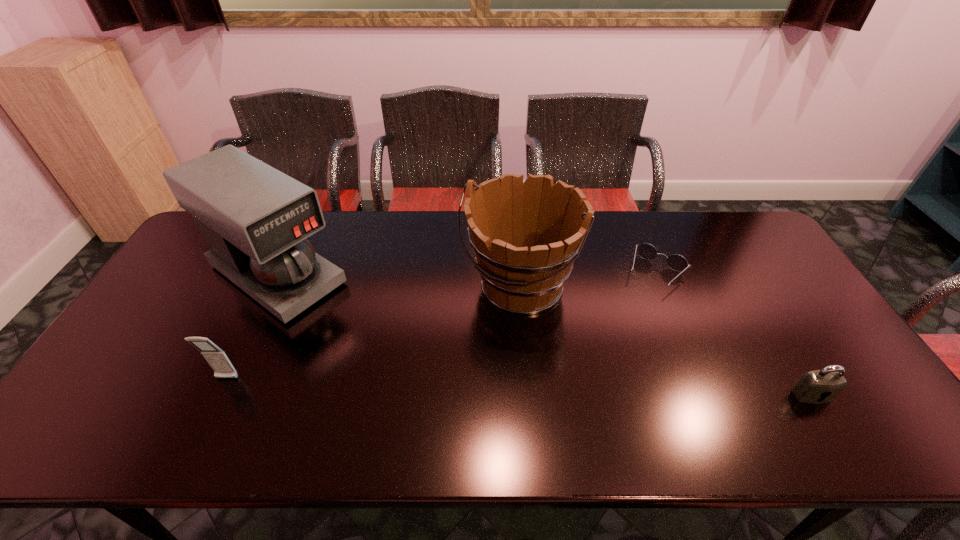
This screenshot has width=960, height=540. What are the coordinates of `the third tallest object` in the screenshot? It's located at (217, 359).

This screenshot has width=960, height=540. I want to click on cellular telephone, so click(217, 359).

Locate an element on the screen. padlock is located at coordinates (821, 386).

What are the coordinates of `the fourth tallest object` in the screenshot? It's located at [x=821, y=386].

You are a GUI agent. You are given a task and a screenshot of the screen. Output one action in this format:
    pyautogui.click(x=<x>, y=<y>)
    Task: Click on the coffee maker
    The image size is (960, 540).
    Given the screenshot: What is the action you would take?
    pyautogui.click(x=255, y=219)

Locate an element on the screen. Image resolution: width=960 pixels, height=540 pixels. spectacles is located at coordinates coord(676,262).

What are the coordinates of `the shortest object` in the screenshot? It's located at (676, 262).

You are a GUI agent. You are given a task and a screenshot of the screen. Output one action in this format:
    pyautogui.click(x=<x>, y=<y>)
    Task: Click on the third object from right to left
    The image size is (960, 540).
    Given the screenshot: What is the action you would take?
    pyautogui.click(x=526, y=236)

This screenshot has height=540, width=960. I want to click on free space located 0.050m on the front-facing side of the fourth farthest object, so click(x=217, y=401).

This screenshot has width=960, height=540. I want to click on vacant space located 0.370m on the carafe side of the coffee maker, so click(x=418, y=372).